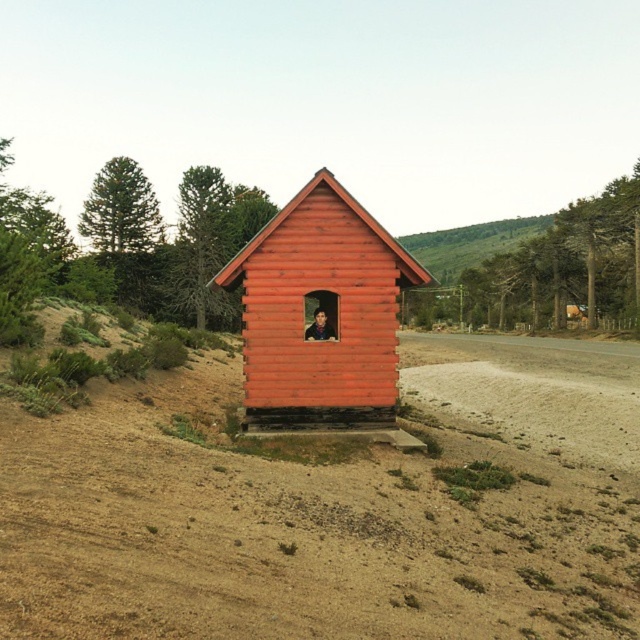
Does dull brown dirt at center appear over smooth wooden cabin at center?

Incorrect, dull brown dirt at center is not positioned above smooth wooden cabin at center.

Is dull brown dirt at center to the right of smooth wooden cabin at center from the viewer's perspective?

Correct, you'll find dull brown dirt at center to the right of smooth wooden cabin at center.

Is point (248, 454) positioned behind point (337, 221)?

No, it is in front of (337, 221).

Identify the location of dull brown dirt at center. (333, 508).